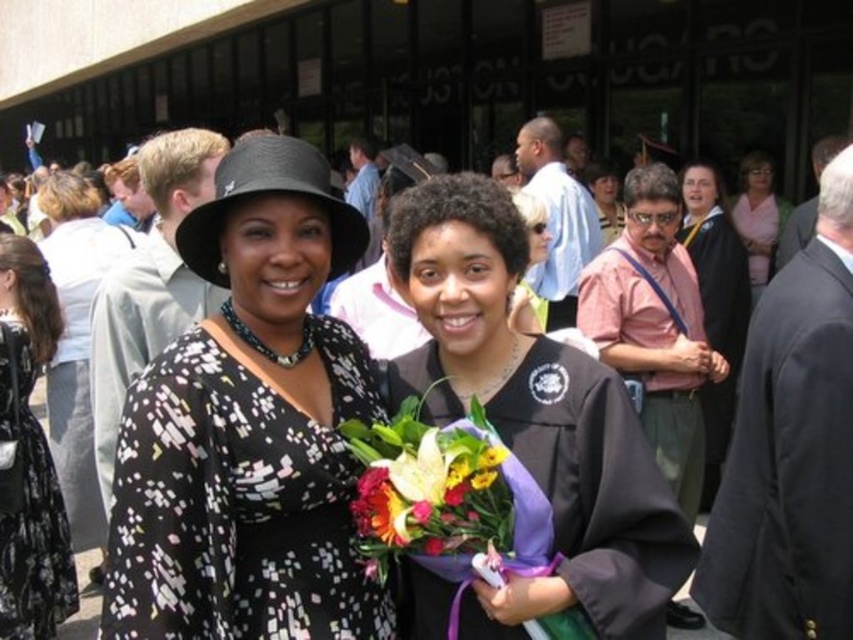
You are a photographer at the graduation ceremony. You need to capture a photo where both the black matte graduation gown at center and the pink fabric at upper right are clearly visible. Given their sizes, which object should you focus on to ensure both are in frame without zooming in or out?

The black matte graduation gown at center is smaller than the pink fabric at upper right. To ensure both are in frame without zooming, focus on the smaller object, the black matte graduation gown at center, as it requires a wider angle to include the larger pink fabric at upper right.

You are a photographer at the graduation ceremony. You want to take a photo of both the black matte graduation gown at center and the vibrant floral bouquet at center. Can you fit both subjects in the frame if your camera has a minimum focus distance of 9 inches?

The black matte graduation gown at center and vibrant floral bouquet at center are 8.95 inches apart, which is less than the camera minimum focus distance of 9 inches. Therefore, both subjects can be captured in the frame.